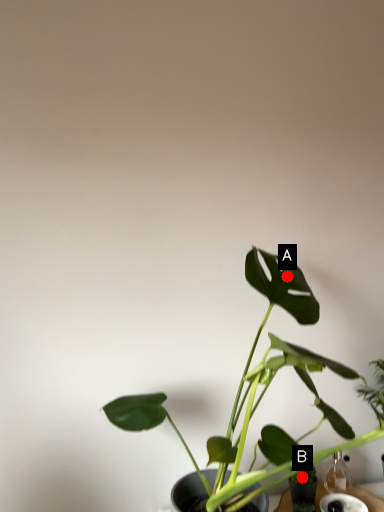
Question: Two points are circled on the image, labeled by A and B beside each circle. Among these points, which one is farthest from the camera?

Choices:
 (A) A is further
 (B) B is further

Answer: (B)